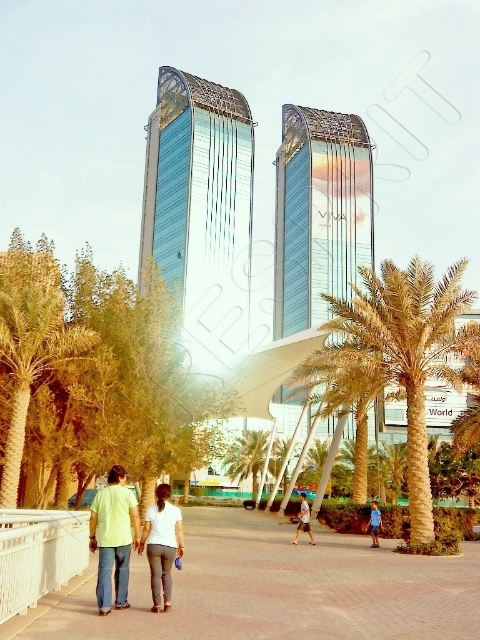
Question: Is paved brick sidewalk at center behind white matte pants at center?

Choices:
 (A) no
 (B) yes

Answer: (A)

Question: Among these points, which one is nearest to the camera?

Choices:
 (A) (179, 548)
 (B) (254, 483)
 (C) (311, 531)

Answer: (A)

Question: Which object is closer to the camera taking this photo?

Choices:
 (A) green leafy palm tree at center
 (B) light yellow shirt at center
 (C) golden textured palm tree at center
 (D) paved brick sidewalk at center

Answer: (D)

Question: Which object is the farthest from the white matte pants at center?

Choices:
 (A) green leafy palm tree at center
 (B) light brown leather jacket at center
 (C) green leafy palm tree at left
 (D) paved brick sidewalk at center

Answer: (A)

Question: Does light yellow shirt at center appear under light brown leather jacket at center?

Choices:
 (A) no
 (B) yes

Answer: (A)

Question: Can you confirm if green leafy palm tree at center is wider than blue cotton shirt at center?

Choices:
 (A) yes
 (B) no

Answer: (A)